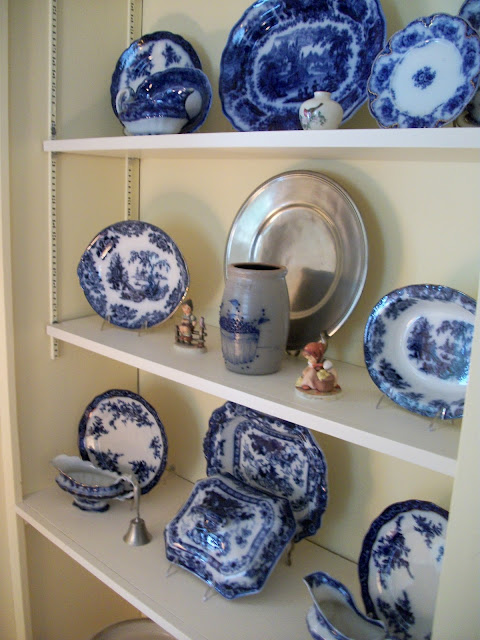
At what (x,y) coordinates should I click in order to perform the action: click on top shelf. Please return your answer as a coordinate pair (x, y). Image resolution: width=480 pixels, height=640 pixels. Looking at the image, I should click on (216, 130).